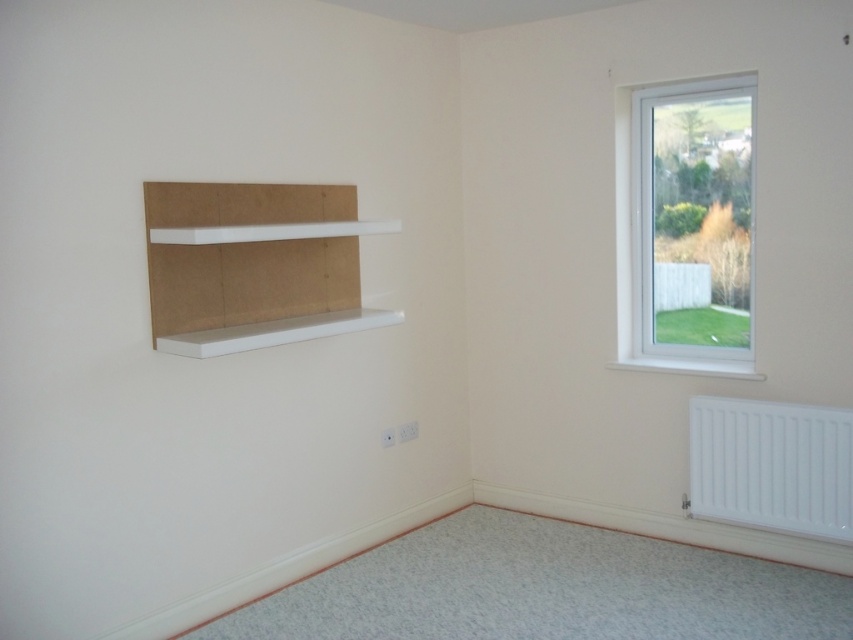
Is white cardboard bookshelf at left to the right of white metallic radiator at lower right from the viewer's perspective?

Incorrect, white cardboard bookshelf at left is not on the right side of white metallic radiator at lower right.

Does white cardboard bookshelf at left appear on the left side of white metallic radiator at lower right?

Indeed, white cardboard bookshelf at left is positioned on the left side of white metallic radiator at lower right.

Identify the location of white cardboard bookshelf at left. (254, 266).

Does white plastic window at upper right appear on the right side of white cardboard bookshelf at left?

Indeed, white plastic window at upper right is positioned on the right side of white cardboard bookshelf at left.

Is point (734, 288) positioned behind point (199, 257)?

Yes, it is.

Where is `white plastic window at upper right`? The height and width of the screenshot is (640, 853). white plastic window at upper right is located at coordinates (688, 227).

Does white plastic window at upper right appear under white metallic radiator at lower right?

Actually, white plastic window at upper right is above white metallic radiator at lower right.

Between white plastic window at upper right and white metallic radiator at lower right, which one has less height?

white metallic radiator at lower right is shorter.

The height and width of the screenshot is (640, 853). I want to click on white plastic window at upper right, so click(688, 227).